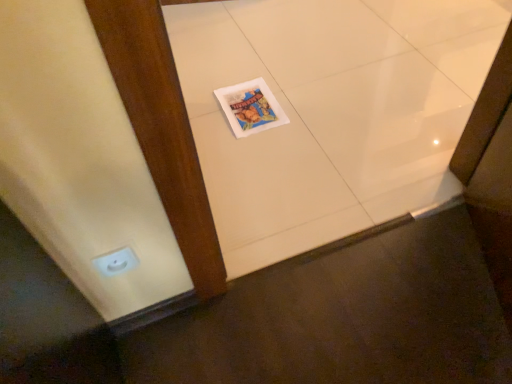
Question: From a real-world perspective, is white glossy tile at center physically above matte paper magazine at center?

Choices:
 (A) no
 (B) yes

Answer: (A)

Question: Is white glossy tile at center smaller than matte paper magazine at center?

Choices:
 (A) no
 (B) yes

Answer: (A)

Question: Is white glossy tile at center oriented towards matte paper magazine at center?

Choices:
 (A) yes
 (B) no

Answer: (A)

Question: Can you confirm if white glossy tile at center is shorter than matte paper magazine at center?

Choices:
 (A) yes
 (B) no

Answer: (B)

Question: Is white glossy tile at center thinner than matte paper magazine at center?

Choices:
 (A) yes
 (B) no

Answer: (B)

Question: Is point (224, 160) positioned closer to the camera than point (251, 84)?

Choices:
 (A) closer
 (B) farther

Answer: (A)

Question: Visually, is white glossy tile at center positioned to the left or to the right of matte paper magazine at center?

Choices:
 (A) left
 (B) right

Answer: (B)

Question: In terms of width, does white glossy tile at center look wider or thinner when compared to matte paper magazine at center?

Choices:
 (A) wide
 (B) thin

Answer: (A)

Question: Considering their positions, is white glossy tile at center located in front of or behind matte paper magazine at center?

Choices:
 (A) behind
 (B) front

Answer: (B)

Question: Considering their positions, is white glossy electric outlet at lower left located in front of or behind matte paper magazine at center?

Choices:
 (A) behind
 (B) front

Answer: (B)

Question: From a real-world perspective, is white glossy electric outlet at lower left positioned above or below matte paper magazine at center?

Choices:
 (A) above
 (B) below

Answer: (A)

Question: Considering the positions of white glossy electric outlet at lower left and matte paper magazine at center in the image, is white glossy electric outlet at lower left bigger or smaller than matte paper magazine at center?

Choices:
 (A) small
 (B) big

Answer: (A)

Question: Which is correct: white glossy electric outlet at lower left is inside matte paper magazine at center, or outside of it?

Choices:
 (A) outside
 (B) inside

Answer: (A)

Question: Is matte paper magazine at center to the left or to the right of white glossy tile at center in the image?

Choices:
 (A) left
 (B) right

Answer: (A)

Question: Relative to white glossy tile at center, is matte paper magazine at center in front or behind?

Choices:
 (A) behind
 (B) front

Answer: (A)